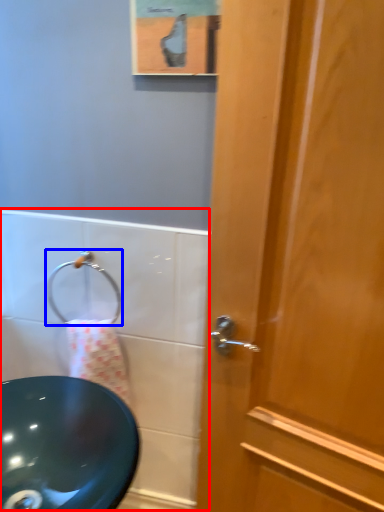
Question: Which of the following is the farthest to the observer, bath (highlighted by a red box) or shower (highlighted by a blue box)?

Choices:
 (A) bath
 (B) shower

Answer: (B)